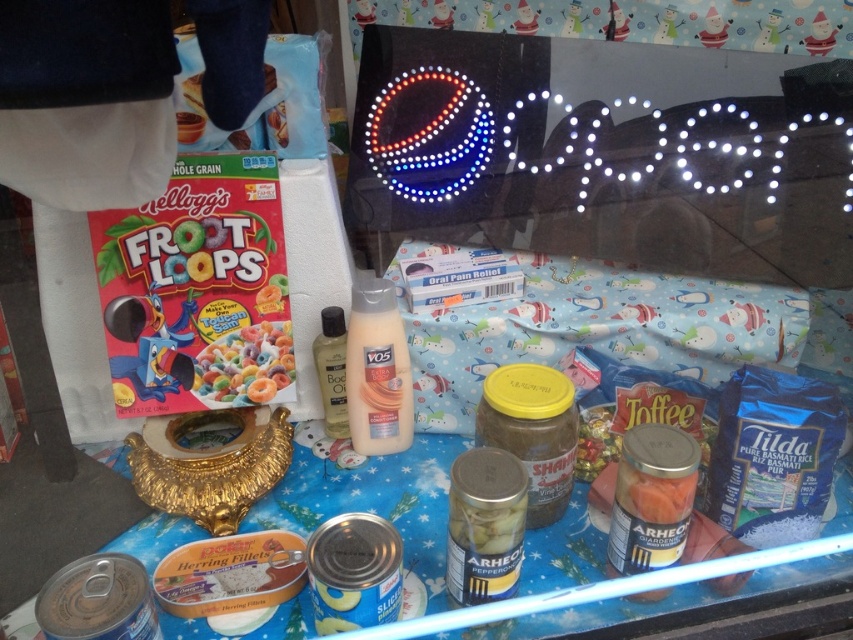
How much distance is there between translucent plastic bottle at center and bright yellow cereal at center?

11.83 centimeters

Between point (376, 365) and point (223, 356), which one is positioned behind?

Point (376, 365)

Between point (370, 381) and point (270, 356), which one is positioned behind?

Positioned behind is point (370, 381).

This screenshot has width=853, height=640. Identify the location of translucent plastic bottle at center. (376, 371).